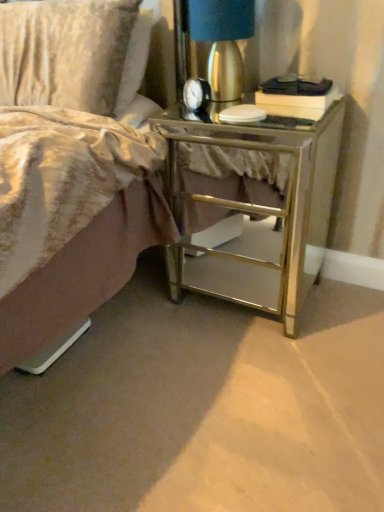
Question: From a real-world perspective, is mirrored glass nightstand at lower right on top of metallic gold lamp at upper right?

Choices:
 (A) yes
 (B) no

Answer: (B)

Question: Would you consider mirrored glass nightstand at lower right to be distant from metallic gold lamp at upper right?

Choices:
 (A) yes
 (B) no

Answer: (B)

Question: Is metallic gold lamp at upper right a part of mirrored glass nightstand at lower right?

Choices:
 (A) no
 (B) yes

Answer: (A)

Question: Is mirrored glass nightstand at lower right with metallic gold lamp at upper right?

Choices:
 (A) yes
 (B) no

Answer: (B)

Question: Is mirrored glass nightstand at lower right oriented towards metallic gold lamp at upper right?

Choices:
 (A) yes
 (B) no

Answer: (B)

Question: From the image's perspective, is mirrored glass nightstand at lower right located above or below velvety gold pillow at upper left?

Choices:
 (A) above
 (B) below

Answer: (B)

Question: In terms of width, does mirrored glass nightstand at lower right look wider or thinner when compared to velvety gold pillow at upper left?

Choices:
 (A) wide
 (B) thin

Answer: (A)

Question: In the image, is mirrored glass nightstand at lower right positioned in front of or behind velvety gold pillow at upper left?

Choices:
 (A) front
 (B) behind

Answer: (A)

Question: Does point (246, 202) appear closer or farther from the camera than point (59, 86)?

Choices:
 (A) closer
 (B) farther

Answer: (B)

Question: Based on their sizes in the image, would you say metallic gold lamp at upper right is bigger or smaller than mirrored glass nightstand at lower right?

Choices:
 (A) big
 (B) small

Answer: (B)

Question: Is metallic gold lamp at upper right inside or outside of mirrored glass nightstand at lower right?

Choices:
 (A) outside
 (B) inside

Answer: (A)

Question: Is metallic gold lamp at upper right to the left or to the right of mirrored glass nightstand at lower right in the image?

Choices:
 (A) left
 (B) right

Answer: (A)

Question: Is metallic gold lamp at upper right taller or shorter than mirrored glass nightstand at lower right?

Choices:
 (A) tall
 (B) short

Answer: (B)

Question: Is velvety gold pillow at upper left to the left or to the right of metallic gold lamp at upper right in the image?

Choices:
 (A) right
 (B) left

Answer: (B)

Question: Do you think velvety gold pillow at upper left is within metallic gold lamp at upper right, or outside of it?

Choices:
 (A) outside
 (B) inside

Answer: (A)